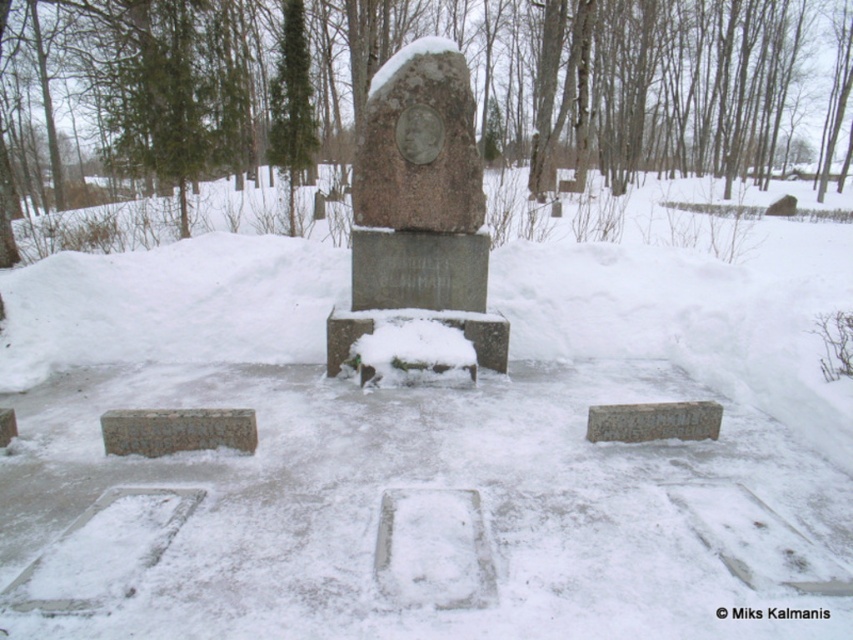
You are a tour guide explaining the winter cemetery scene to visitors. You want to highlight the size difference between the granite statue at center and the gray stone plaque at center. How would you describe their sizes in relation to each other?

The granite statue at center is bigger than the gray stone plaque at center, so I would mention that the statue is larger in size compared to the plaque.

In the scene shown: You are standing at the point closest to the monument in the winter scene. You want to walk straight towards the monument. Will you first encounter the point labeled as point (677, 412) or point (4, 420)?

You will first encounter point (4, 420) because it is closer to your starting position, and point (677, 412) is behind it.

You are standing at the entrance of the cemetery and want to read the inscriptions on both the gray stone plaque at center and the gray stone gravestone at lower left. Which one can you see more clearly?

The gray stone plaque at center can be seen more clearly because the gray stone gravestone at lower left is behind it, making its inscription harder to read.